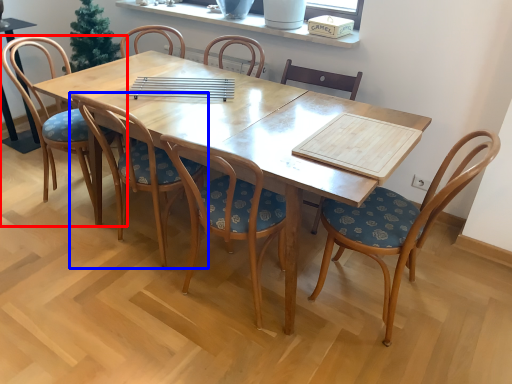
Question: Which object is further to the camera taking this photo, chair (highlighted by a red box) or chair (highlighted by a blue box)?

Choices:
 (A) chair
 (B) chair

Answer: (A)